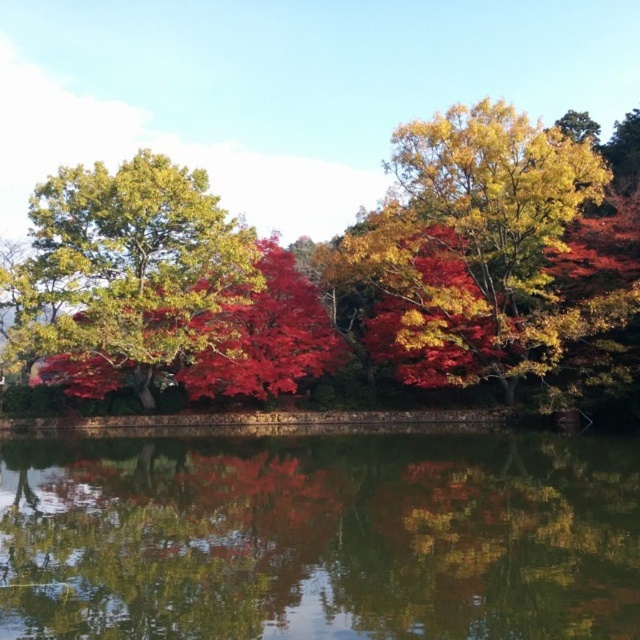
Question: Can you confirm if green reflective water at center is thinner than shiny red leaves at center?

Choices:
 (A) yes
 (B) no

Answer: (A)

Question: Which object is closer to the camera taking this photo?

Choices:
 (A) shiny red leaves at center
 (B) green reflective water at center
 (C) shiny green leaves at left

Answer: (B)

Question: Estimate the real-world distances between objects in this image. Which object is farther from the green reflective water at center?

Choices:
 (A) shiny red leaves at center
 (B) shiny green leaves at left

Answer: (B)

Question: Is shiny red leaves at center to the right of shiny green leaves at left from the viewer's perspective?

Choices:
 (A) yes
 (B) no

Answer: (A)

Question: Is shiny red leaves at center smaller than shiny green leaves at left?

Choices:
 (A) no
 (B) yes

Answer: (A)

Question: Which of these objects is positioned farthest from the shiny red leaves at center?

Choices:
 (A) green reflective water at center
 (B) shiny green leaves at left

Answer: (A)